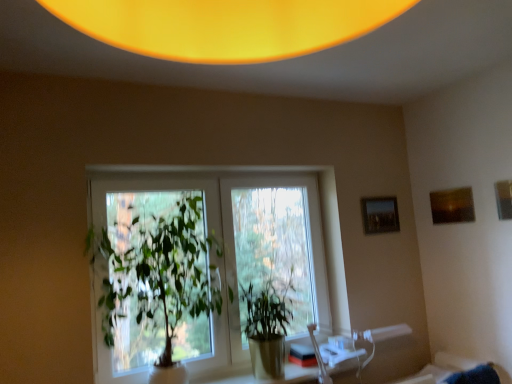
Question: Is matte brown picture frame at upper right, which is the 2th picture frame from left to right, at the right side of green glossy plant at center, the 1th houseplant from the right?

Choices:
 (A) no
 (B) yes

Answer: (B)

Question: Considering the relative positions of matte brown picture frame at upper right, which ranks as the second picture frame in back-to-front order, and green glossy plant at center, acting as the 2th houseplant starting from the left, in the image provided, is matte brown picture frame at upper right, which ranks as the second picture frame in back-to-front order, to the left of green glossy plant at center, acting as the 2th houseplant starting from the left, from the viewer's perspective?

Choices:
 (A) no
 (B) yes

Answer: (A)

Question: Does matte brown picture frame at upper right, which is the 2th picture frame from left to right, have a greater height compared to green glossy plant at center, acting as the 2th houseplant starting from the left?

Choices:
 (A) no
 (B) yes

Answer: (A)

Question: Is the surface of matte brown picture frame at upper right, which is the 2th picture frame from left to right, in direct contact with green glossy plant at center, acting as the 2th houseplant starting from the left?

Choices:
 (A) no
 (B) yes

Answer: (A)

Question: Can you confirm if matte brown picture frame at upper right, which ranks as the second picture frame in back-to-front order, is shorter than green glossy plant at center, acting as the 2th houseplant starting from the left?

Choices:
 (A) yes
 (B) no

Answer: (A)

Question: Visually, is green leafy plant at center, which is the 2th houseplant from right to left, positioned to the left or to the right of green glossy plant at center, acting as the 2th houseplant starting from the left?

Choices:
 (A) right
 (B) left

Answer: (B)

Question: Considering the positions of green leafy plant at center, the first houseplant from the left, and green glossy plant at center, the 1th houseplant from the right, in the image, is green leafy plant at center, the first houseplant from the left, wider or thinner than green glossy plant at center, the 1th houseplant from the right,?

Choices:
 (A) wide
 (B) thin

Answer: (A)

Question: From their relative heights in the image, would you say green leafy plant at center, which is the 2th houseplant from right to left, is taller or shorter than green glossy plant at center, the 1th houseplant from the right?

Choices:
 (A) short
 (B) tall

Answer: (B)

Question: Would you say green leafy plant at center, the first houseplant from the left, is inside or outside green glossy plant at center, the 1th houseplant from the right?

Choices:
 (A) outside
 (B) inside

Answer: (A)

Question: Looking at their shapes, would you say matte black picture frame at upper right, which is counted as the third picture frame, starting from the right, is wider or thinner than wooden picture frame at upper right, marked as the 1th picture frame in a right-to-left arrangement?

Choices:
 (A) thin
 (B) wide

Answer: (B)

Question: From the image's perspective, is matte black picture frame at upper right, which is the first picture frame in back-to-front order, located above or below wooden picture frame at upper right, the third picture frame in the left-to-right sequence?

Choices:
 (A) below
 (B) above

Answer: (A)

Question: Considering their positions, is matte black picture frame at upper right, which is the first picture frame in back-to-front order, located in front of or behind wooden picture frame at upper right, the 1th picture frame in the front-to-back sequence?

Choices:
 (A) front
 (B) behind

Answer: (B)

Question: Would you say matte black picture frame at upper right, the third picture frame from the front, is to the left or to the right of wooden picture frame at upper right, the third picture frame in the left-to-right sequence, in the picture?

Choices:
 (A) right
 (B) left

Answer: (B)

Question: In terms of width, does green leafy plant at center, the first houseplant from the left, look wider or thinner when compared to translucent glass table at center?

Choices:
 (A) thin
 (B) wide

Answer: (B)

Question: In the image, is green leafy plant at center, the first houseplant from the left, positioned in front of or behind translucent glass table at center?

Choices:
 (A) front
 (B) behind

Answer: (A)